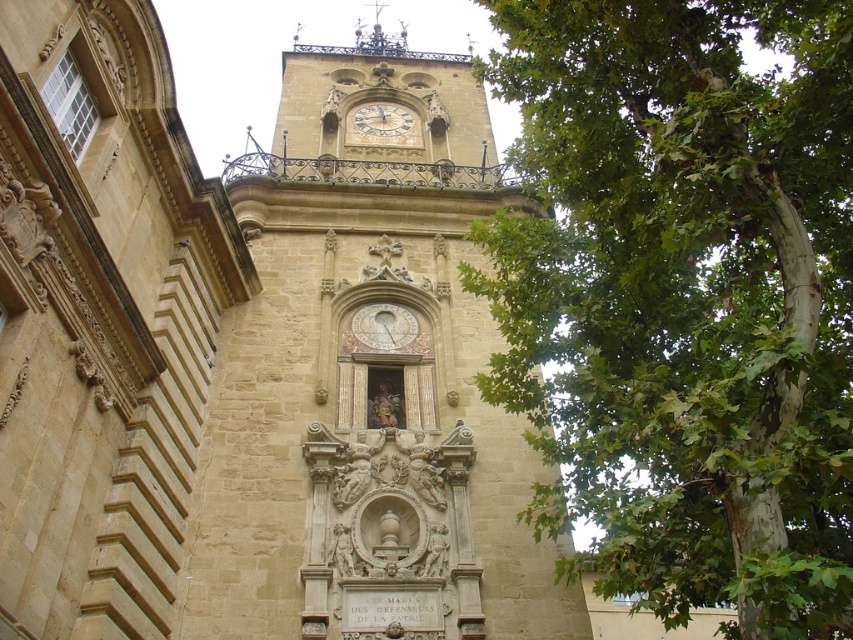
You are an architect examining the historic stone building. You notice the green leafy tree at upper right and the gold metallic clock at center. Which object is situated to the right of the other?

The green leafy tree at upper right is positioned on the right side of gold metallic clock at center.

You are standing in front of the historic stone building and want to take a photo of both the clock tower and the statue niche. You notice two points marked on the building facade. The first point is at coordinates point (351, 518) and the second is at point (801, 237). To ensure both points are in focus, which point should you focus on first?

Point (351, 518) is behind point (801, 237), so you should focus on the closer point (801, 237) first to ensure both are in focus.